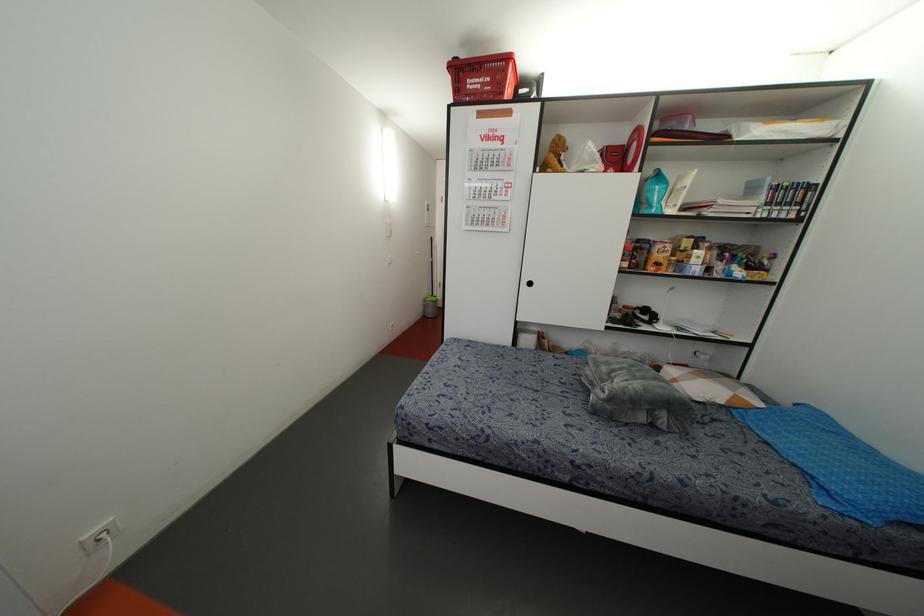
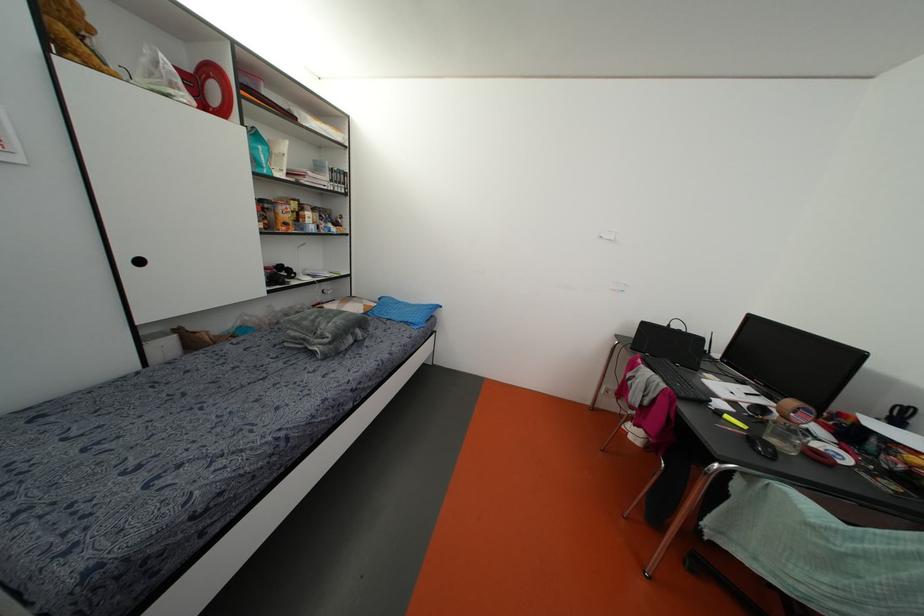
The first image is from the beginning of the video and the second image is from the end. How did the camera likely rotate when shooting the video?

The camera's rotation is toward right-down.